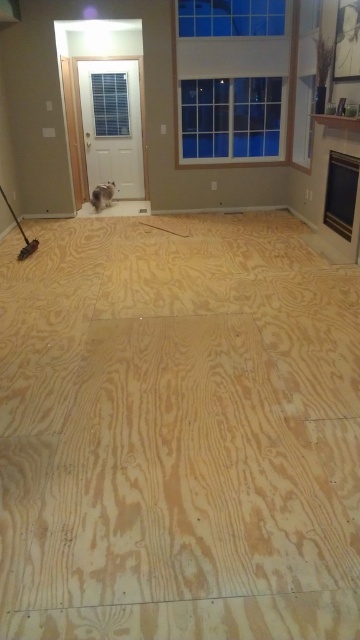
Question: Which object is closer to the camera taking this photo?

Choices:
 (A) natural wood floor at center
 (B) white fluffy cat at center

Answer: (A)

Question: Does natural wood floor at center appear under white fluffy cat at center?

Choices:
 (A) yes
 (B) no

Answer: (A)

Question: Does natural wood floor at center appear over white fluffy cat at center?

Choices:
 (A) no
 (B) yes

Answer: (A)

Question: Which point is closer to the camera?

Choices:
 (A) (123, 228)
 (B) (105, 193)

Answer: (A)

Question: Can you confirm if natural wood floor at center is bigger than white fluffy cat at center?

Choices:
 (A) no
 (B) yes

Answer: (B)

Question: Which object appears farthest from the camera in this image?

Choices:
 (A) white fluffy cat at center
 (B) natural wood floor at center

Answer: (A)